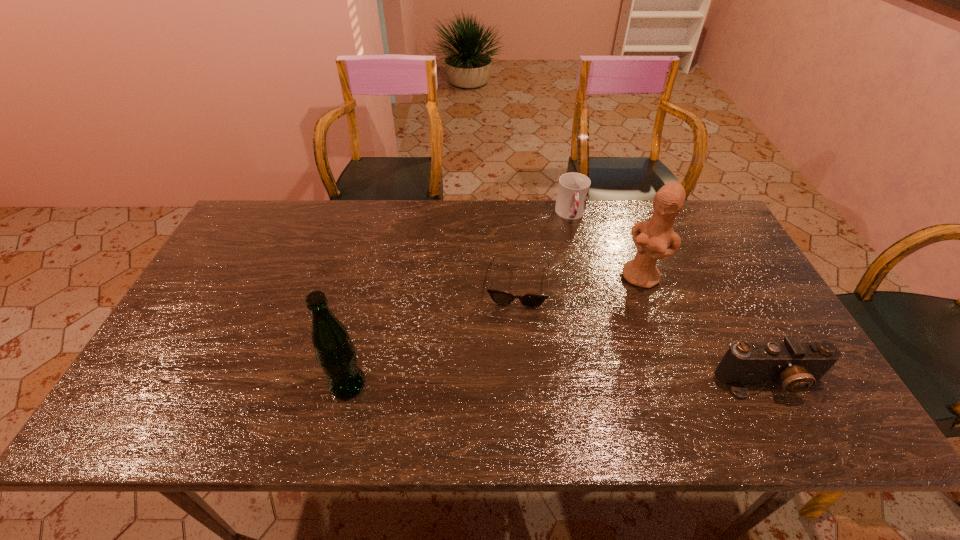
Locate an element on the screen. The width and height of the screenshot is (960, 540). free region located on the front-facing side of the figurine is located at coordinates (575, 384).

This screenshot has width=960, height=540. Identify the location of vacant space located on the handle side of the third object from right to left. (578, 252).

This screenshot has height=540, width=960. I want to click on blank space located on the handle side of the third object from right to left, so click(576, 242).

Locate an element on the screen. free location located 0.140m on the handle side of the third object from right to left is located at coordinates (579, 257).

This screenshot has height=540, width=960. I want to click on vacant point located 0.180m on the front lenses of the second object from left to right, so click(510, 365).

Where is `free point located on the front lenses of the second object from left to right`? The height and width of the screenshot is (540, 960). free point located on the front lenses of the second object from left to right is located at coordinates (512, 348).

Where is `vacant region located on the front lenses of the second object from left to right`? The width and height of the screenshot is (960, 540). vacant region located on the front lenses of the second object from left to right is located at coordinates (510, 361).

Find the location of a particular element. object present at the far edge is located at coordinates (573, 188).

At what (x,y) coordinates should I click in order to perform the action: click on beer bottle situated at the near edge. Please return your answer as a coordinate pair (x, y). The image size is (960, 540). Looking at the image, I should click on (335, 352).

You are a GUI agent. You are given a task and a screenshot of the screen. Output one action in this format:
    pyautogui.click(x=<x>, y=<y>)
    Task: Click on the camera located in the near edge section of the desktop
    This screenshot has width=960, height=540.
    Given the screenshot: What is the action you would take?
    pyautogui.click(x=798, y=366)